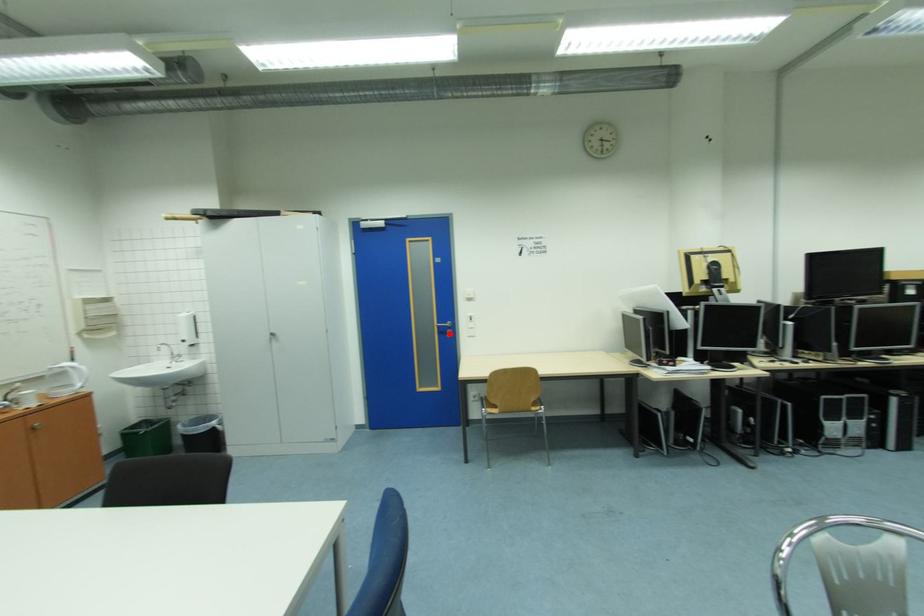
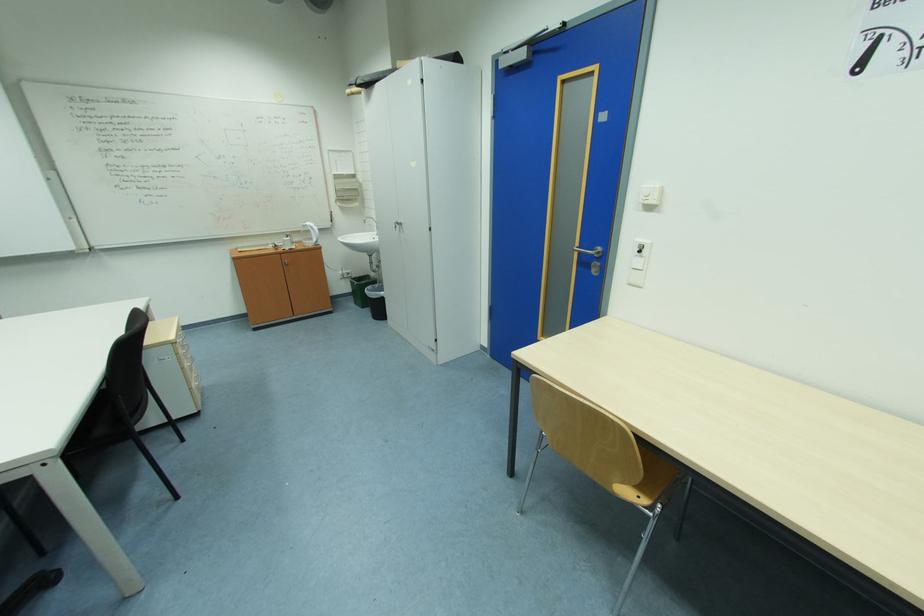
The point at the highlighted location is marked in the first image. Where is the corresponding point in the second image?

(590, 264)